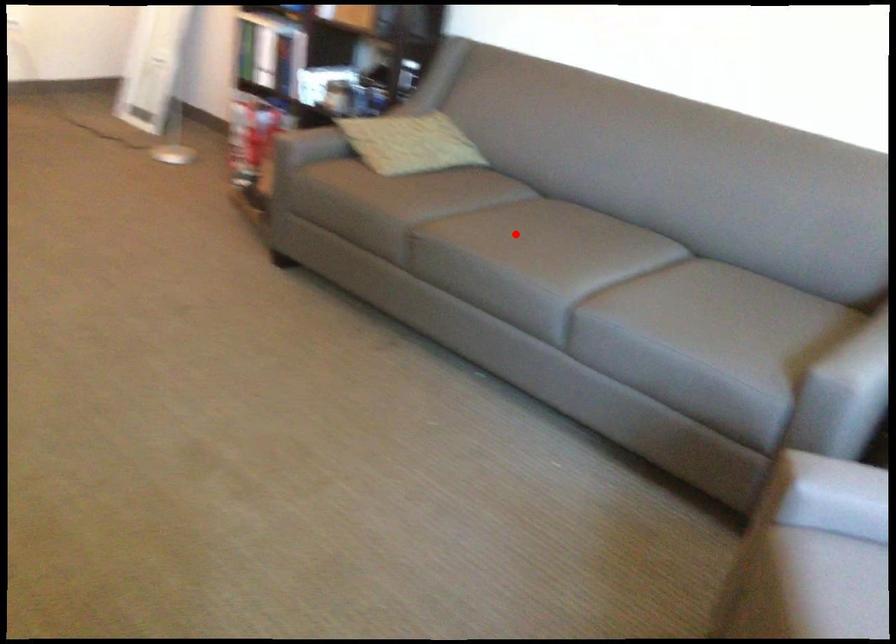
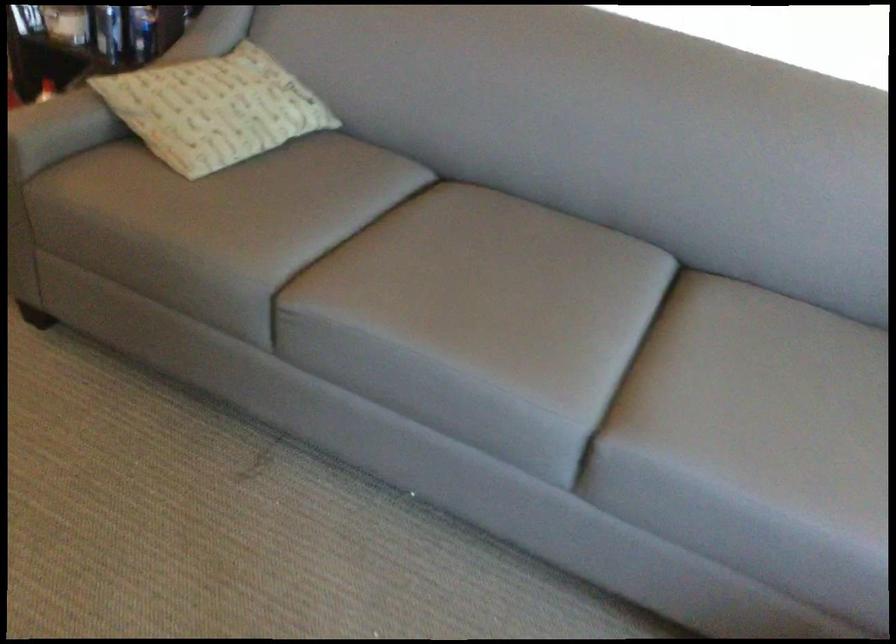
Question: I am providing you with two images of the same scene from different viewpoints. In image1, a red point is highlighted. Considering the same 3D point in image2, which of the following is correct?

Choices:
 (A) It is closer
 (B) It is farther

Answer: (A)